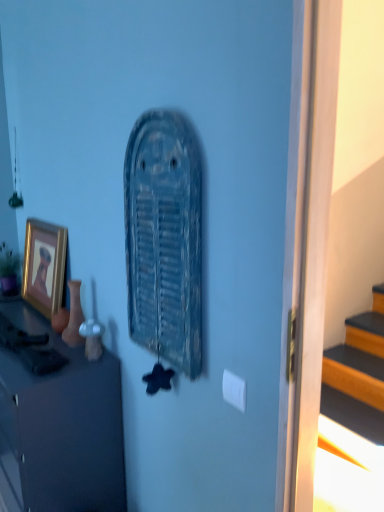
Question: From a real-world perspective, is gold-framed picture at left on top of matte black cabinet at left?

Choices:
 (A) yes
 (B) no

Answer: (A)

Question: Does gold-framed picture at left lie behind matte black cabinet at left?

Choices:
 (A) no
 (B) yes

Answer: (B)

Question: Is gold-framed picture at left at the right side of matte black cabinet at left?

Choices:
 (A) yes
 (B) no

Answer: (A)

Question: Is gold-framed picture at left completely or partially outside of matte black cabinet at left?

Choices:
 (A) no
 (B) yes

Answer: (B)

Question: Does gold-framed picture at left have a lesser height compared to matte black cabinet at left?

Choices:
 (A) yes
 (B) no

Answer: (A)

Question: Is green matte houseplant at left taller or shorter than gold-framed picture at left?

Choices:
 (A) short
 (B) tall

Answer: (A)

Question: From a real-world perspective, is green matte houseplant at left above or below gold-framed picture at left?

Choices:
 (A) below
 (B) above

Answer: (A)

Question: From the image's perspective, is green matte houseplant at left positioned above or below gold-framed picture at left?

Choices:
 (A) below
 (B) above

Answer: (A)

Question: Is point (1, 251) positioned closer to the camera than point (34, 301)?

Choices:
 (A) farther
 (B) closer

Answer: (A)

Question: Is matte black cabinet at left taller or shorter than gold-framed picture at left?

Choices:
 (A) tall
 (B) short

Answer: (A)

Question: Is point (56, 475) positioned closer to the camera than point (46, 250)?

Choices:
 (A) farther
 (B) closer

Answer: (B)

Question: From a real-world perspective, is matte black cabinet at left positioned above or below gold-framed picture at left?

Choices:
 (A) above
 (B) below

Answer: (B)

Question: From the image's perspective, relative to gold-framed picture at left, is matte black cabinet at left above or below?

Choices:
 (A) below
 (B) above

Answer: (A)

Question: In terms of height, does rusty metal vent at center look taller or shorter compared to gold-framed picture at left?

Choices:
 (A) short
 (B) tall

Answer: (B)

Question: From a real-world perspective, is rusty metal vent at center physically located above or below gold-framed picture at left?

Choices:
 (A) above
 (B) below

Answer: (A)